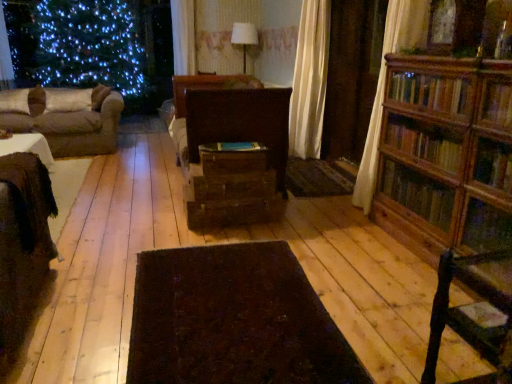
Question: Considering the positions of dark wool rug at center and wooden bookcase at right in the image, is dark wool rug at center taller or shorter than wooden bookcase at right?

Choices:
 (A) short
 (B) tall

Answer: (A)

Question: Is point (151, 340) positioned closer to the camera than point (493, 144)?

Choices:
 (A) farther
 (B) closer

Answer: (B)

Question: Which of these objects is positioned farthest from the white fabric lampshade at upper center?

Choices:
 (A) blue matte book at center
 (B) dark wool rug at center
 (C) wooden drawer at center, which appears as the 1th drawer when viewed from the top
 (D) brown fabric couch at left
 (E) brown wood drawer at center, marked as the first drawer in a bottom-to-top arrangement

Answer: (B)

Question: Which object is positioned closest to the dark wool rug at center?

Choices:
 (A) blue matte book at center
 (B) dark wood cabinet at center
 (C) brown fabric couch at left
 (D) brown wood drawer at center, marked as the first drawer in a bottom-to-top arrangement
 (E) dark brown wooden chair at lower right

Answer: (E)